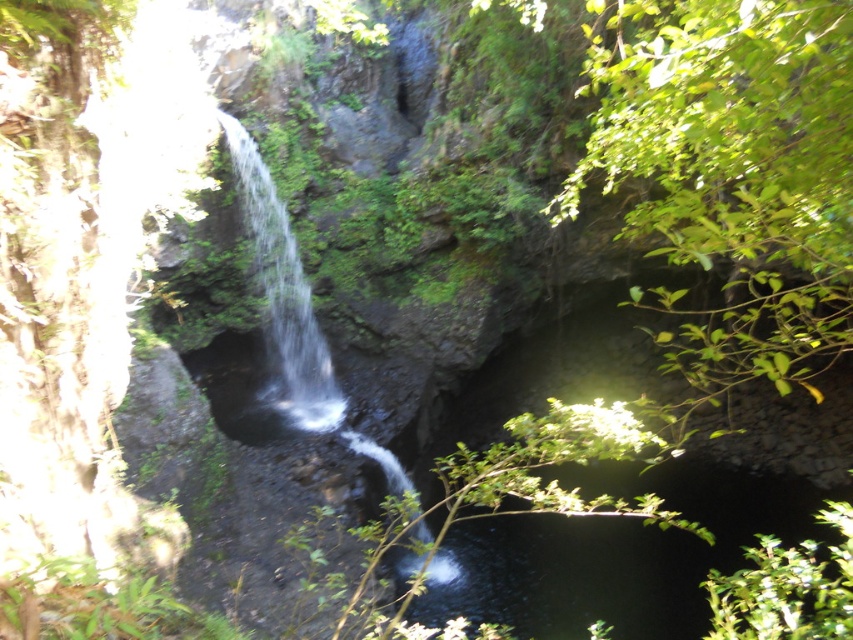
Question: Is green leafy bush at lower right closer to camera compared to clear water at center?

Choices:
 (A) yes
 (B) no

Answer: (A)

Question: Does green leafy bush at lower right have a greater width compared to clear water at center?

Choices:
 (A) yes
 (B) no

Answer: (A)

Question: Considering the relative positions of green leafy bush at lower right and clear water at center in the image provided, where is green leafy bush at lower right located with respect to clear water at center?

Choices:
 (A) left
 (B) right

Answer: (B)

Question: Which point is closer to the camera?

Choices:
 (A) green leafy bush at lower right
 (B) clear water at center

Answer: (A)

Question: Which object is closer to the camera taking this photo?

Choices:
 (A) clear water at center
 (B) green leafy bush at lower right

Answer: (B)